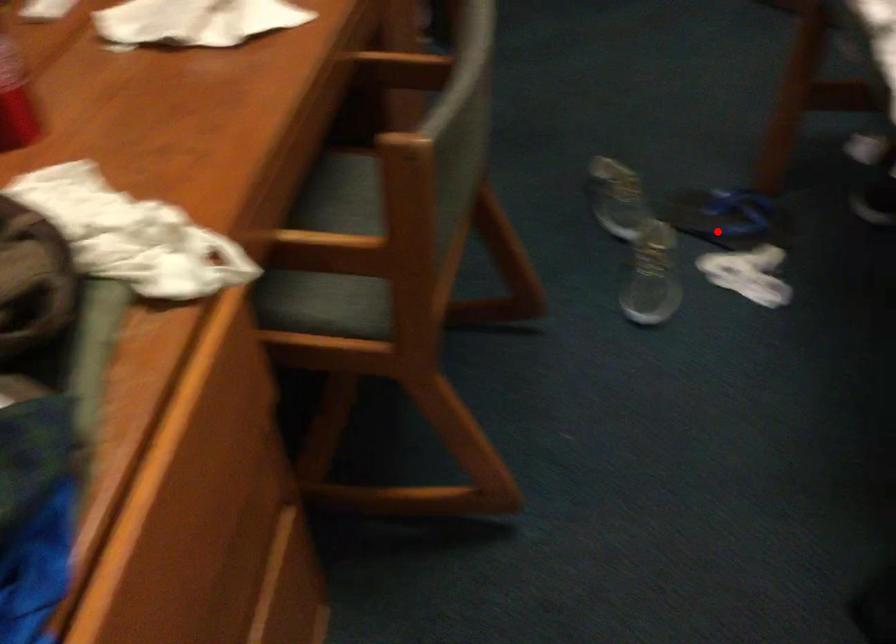
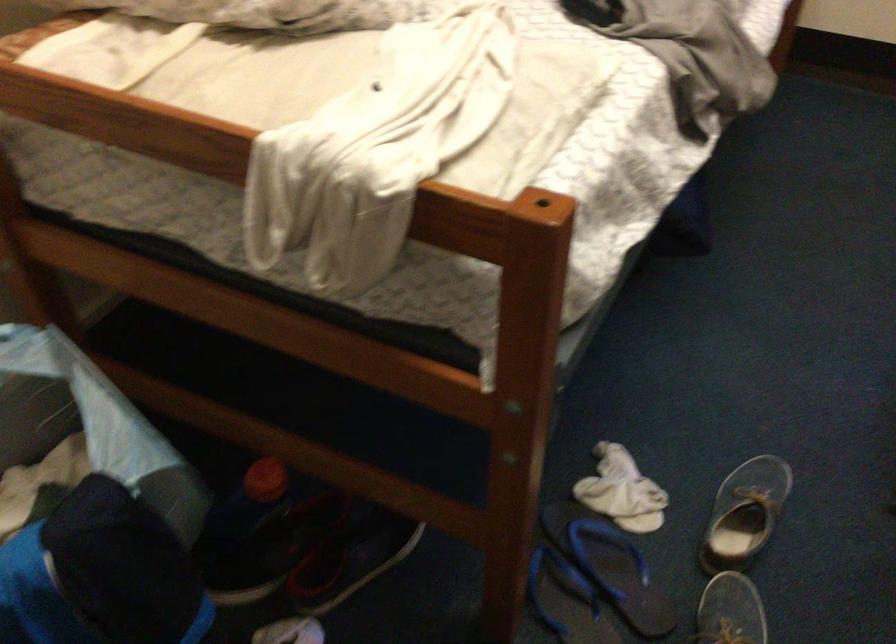
In the second image, find the point that corresponds to the highlighted location in the first image.

(609, 565)